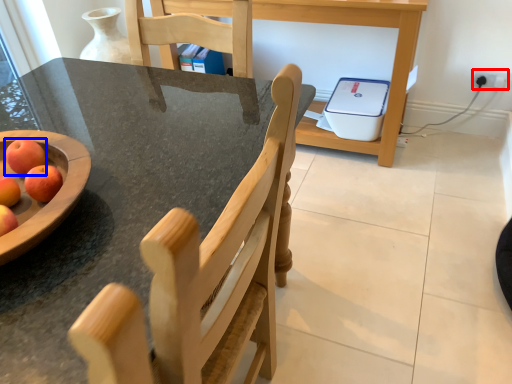
Question: Which point is closer to the camera, electric outlet (highlighted by a red box) or apple (highlighted by a blue box)?

Choices:
 (A) electric outlet
 (B) apple

Answer: (B)